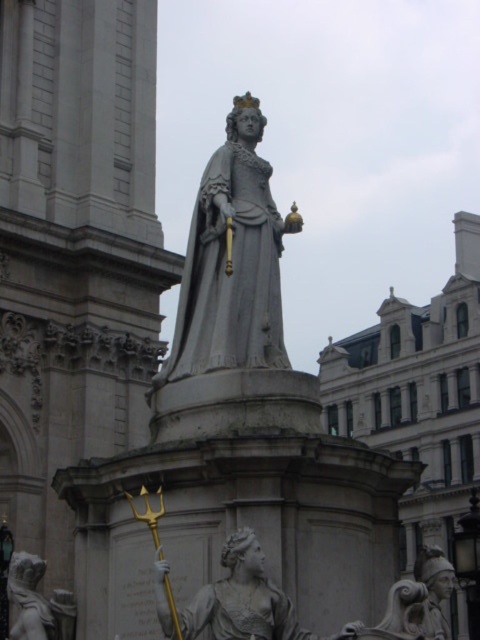
Question: Is gray stone statue at center smaller than white marble trident at lower left?

Choices:
 (A) yes
 (B) no

Answer: (B)

Question: Which of these objects is positioned closest to the matte gray statue at center?

Choices:
 (A) gray stone statue at center
 (B) white marble trident at lower left

Answer: (B)

Question: Among these points, which one is farthest from the camera?

Choices:
 (A) (14, 628)
 (B) (232, 232)

Answer: (B)

Question: Can you confirm if gray stone statue at center is wider than matte gray statue at center?

Choices:
 (A) yes
 (B) no

Answer: (A)

Question: Which object is positioned farthest from the white marble trident at lower left?

Choices:
 (A) gray stone statue at center
 (B) matte gray statue at center

Answer: (A)

Question: Observing the image, what is the correct spatial positioning of gray stone statue at center in reference to white marble trident at lower left?

Choices:
 (A) left
 (B) right

Answer: (B)